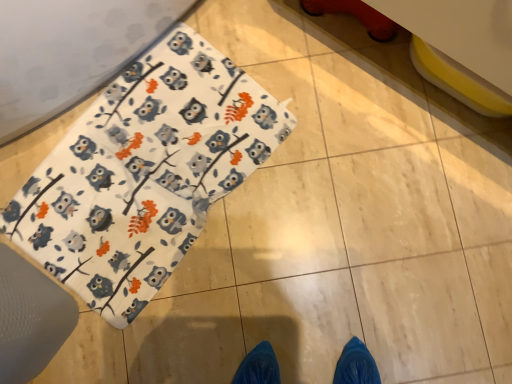
Where is `white fabric towel at lower left`? The width and height of the screenshot is (512, 384). white fabric towel at lower left is located at coordinates (145, 173).

Describe the element at coordinates (145, 173) in the screenshot. I see `white fabric towel at lower left` at that location.

I want to click on white fabric towel at lower left, so 145,173.